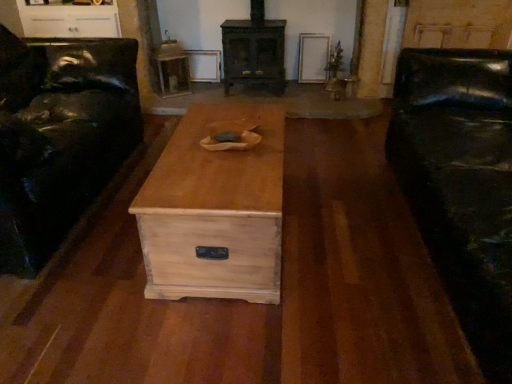
Identify the location of unoccupied area in front of wooden side table at upper center. (172, 104).